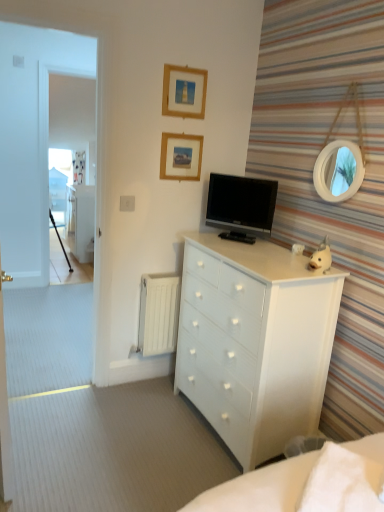
Find the location of a particular element. Image resolution: width=384 pixels, height=512 pixels. free region under white matte radiator at lower left (from a real-world perspective) is located at coordinates (156, 379).